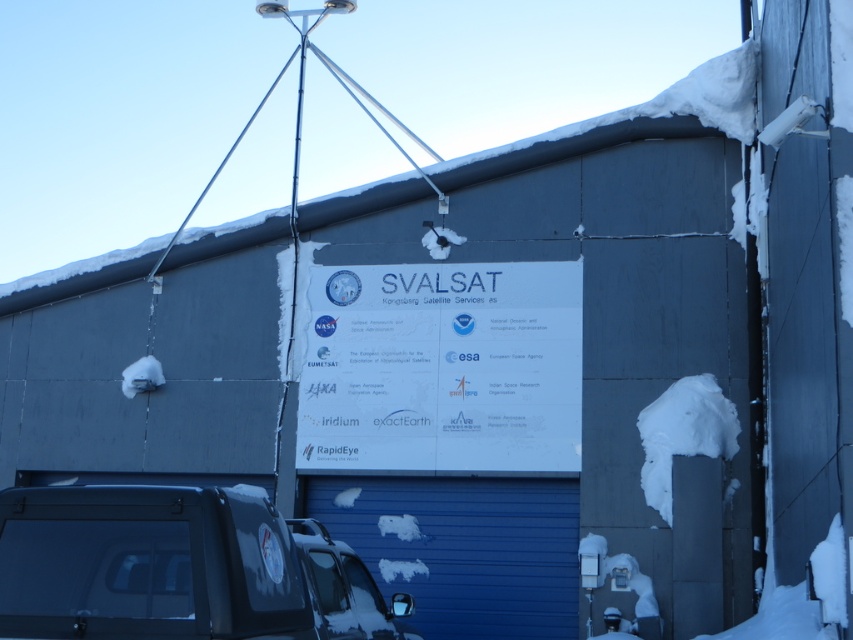
From the picture: Is blue metallic garage door at lower center above white fluffy snow at right?

Incorrect, blue metallic garage door at lower center is not positioned above white fluffy snow at right.

This screenshot has width=853, height=640. Describe the element at coordinates (463, 548) in the screenshot. I see `blue metallic garage door at lower center` at that location.

Locate an element on the screen. This screenshot has width=853, height=640. blue metallic garage door at lower center is located at coordinates (463, 548).

Is shiny black suv at lower left to the left of blue metallic garage door at lower center from the viewer's perspective?

Correct, you'll find shiny black suv at lower left to the left of blue metallic garage door at lower center.

Which of these two, shiny black suv at lower left or blue metallic garage door at lower center, stands shorter?

With less height is shiny black suv at lower left.

Which is behind, point (16, 596) or point (402, 506)?

The point (402, 506) is more distant.

Image resolution: width=853 pixels, height=640 pixels. I want to click on shiny black suv at lower left, so click(178, 568).

Is white paper sign at center below shiny black suv at lower left?

Incorrect, white paper sign at center is not positioned below shiny black suv at lower left.

Is white paper sign at center positioned in front of shiny black suv at lower left?

That is False.

Is point (422, 468) positioned before point (363, 579)?

No, it is behind (363, 579).

Image resolution: width=853 pixels, height=640 pixels. I want to click on white paper sign at center, so click(442, 369).